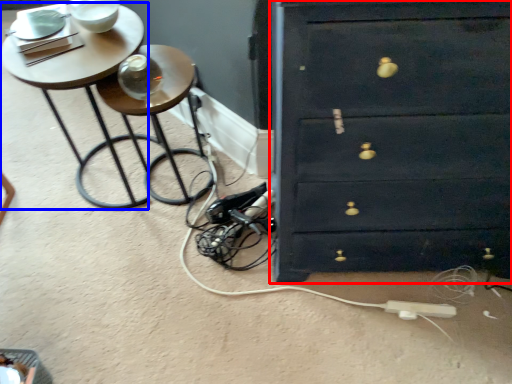
Question: Among these objects, which one is nearest to the camera, chest of drawers (highlighted by a red box) or table (highlighted by a blue box)?

Choices:
 (A) chest of drawers
 (B) table

Answer: (A)